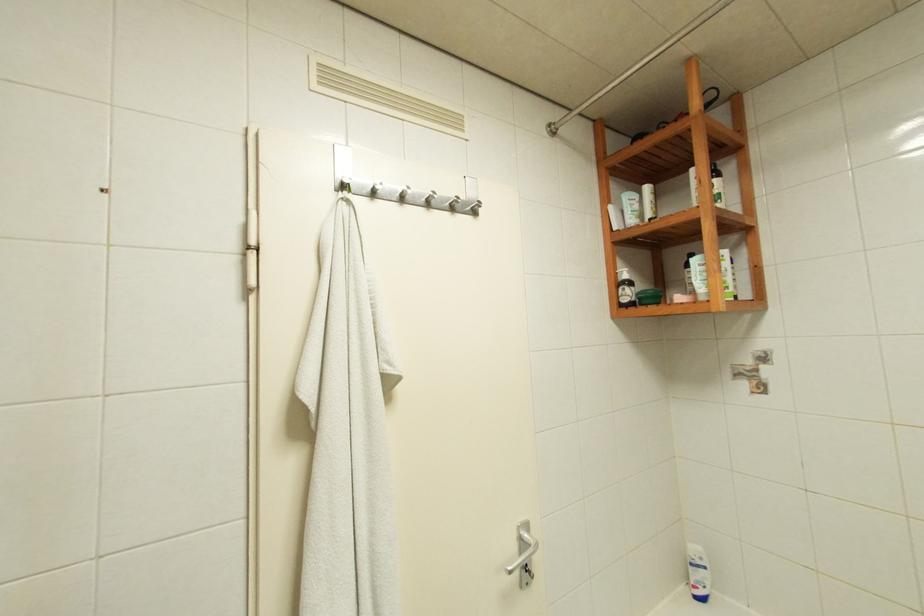
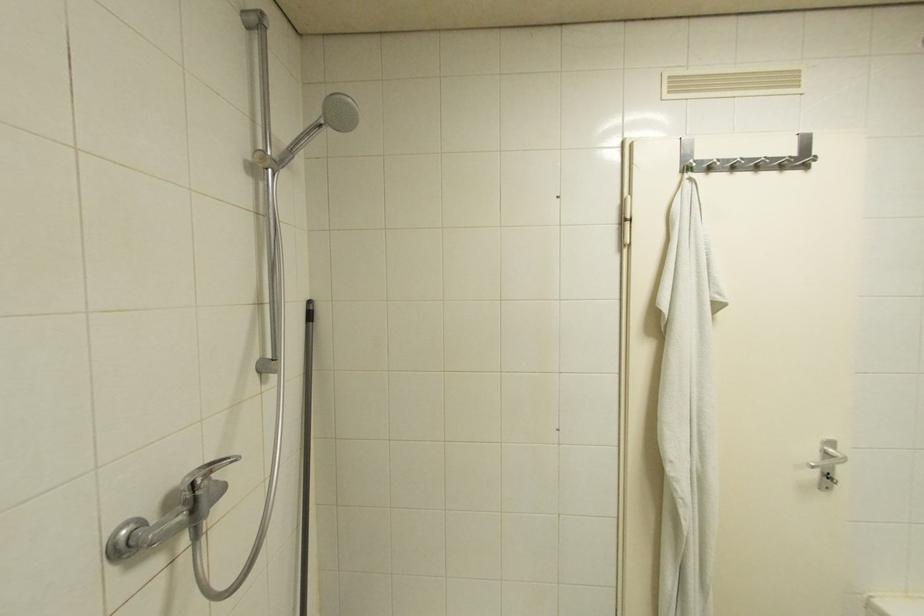
Question: How did the camera likely rotate?

Choices:
 (A) Left
 (B) Right
 (C) Up
 (D) Down

Answer: (A)